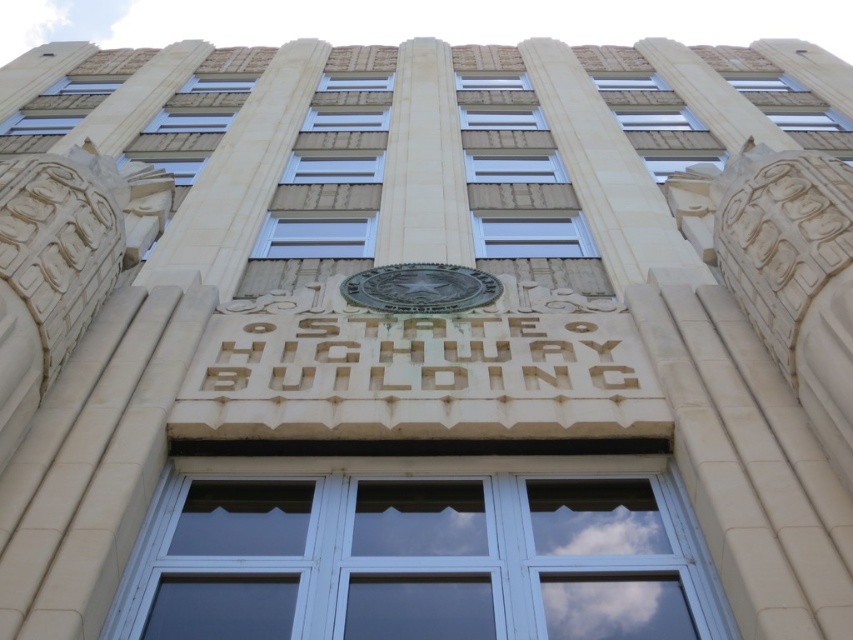
Question: Is white carved stone at center to the right of bronze textured seal at center from the viewer's perspective?

Choices:
 (A) yes
 (B) no

Answer: (A)

Question: Is white carved stone at center smaller than bronze textured seal at center?

Choices:
 (A) yes
 (B) no

Answer: (A)

Question: Is white carved stone at center closer to camera compared to bronze textured seal at center?

Choices:
 (A) yes
 (B) no

Answer: (A)

Question: Which point is farther to the camera?

Choices:
 (A) white carved stone at center
 (B) bronze textured seal at center

Answer: (B)

Question: Which point appears farthest from the camera in this image?

Choices:
 (A) (410, 292)
 (B) (309, 332)

Answer: (A)